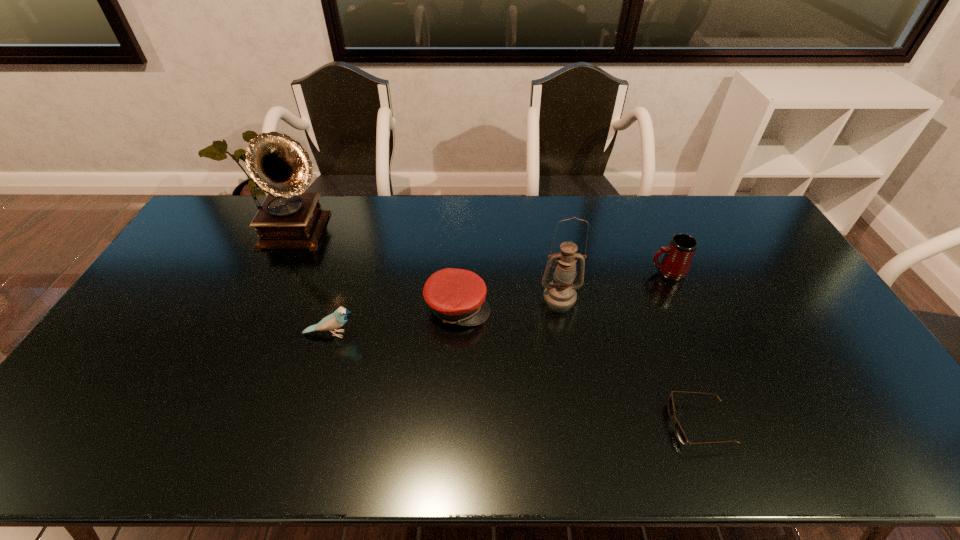
Identify the location of object at the far edge. tap(287, 219).

This screenshot has width=960, height=540. What are the coordinates of `object present at the near edge` in the screenshot? It's located at (679, 432).

Identify the location of vacant space at the far edge of the desktop. This screenshot has width=960, height=540. (589, 218).

In the image, there is a desktop. Find the location of `vacant space at the near edge`. vacant space at the near edge is located at coordinates (536, 444).

Where is `vacant space at the left edge of the desktop`? This screenshot has width=960, height=540. vacant space at the left edge of the desktop is located at coordinates (136, 361).

Where is `vacant region at the right edge of the desktop`? vacant region at the right edge of the desktop is located at coordinates (814, 372).

In the image, there is a desktop. What are the coordinates of `vacant space at the far right corner` in the screenshot? It's located at (714, 201).

Find the location of a particular element. vacant area that lies between the fifth object from right to left and the second shortest object is located at coordinates (395, 320).

You are a GUI agent. You are given a task and a screenshot of the screen. Output one action in this format:
    pyautogui.click(x=<x>, y=<y>)
    Task: Click on the unoccupied area between the leftmost object and the mug
    Image resolution: width=960 pixels, height=540 pixels.
    Given the screenshot: What is the action you would take?
    pyautogui.click(x=483, y=253)

What are the coordinates of `unoccupied position between the cap and the oil lamp` in the screenshot? It's located at (509, 301).